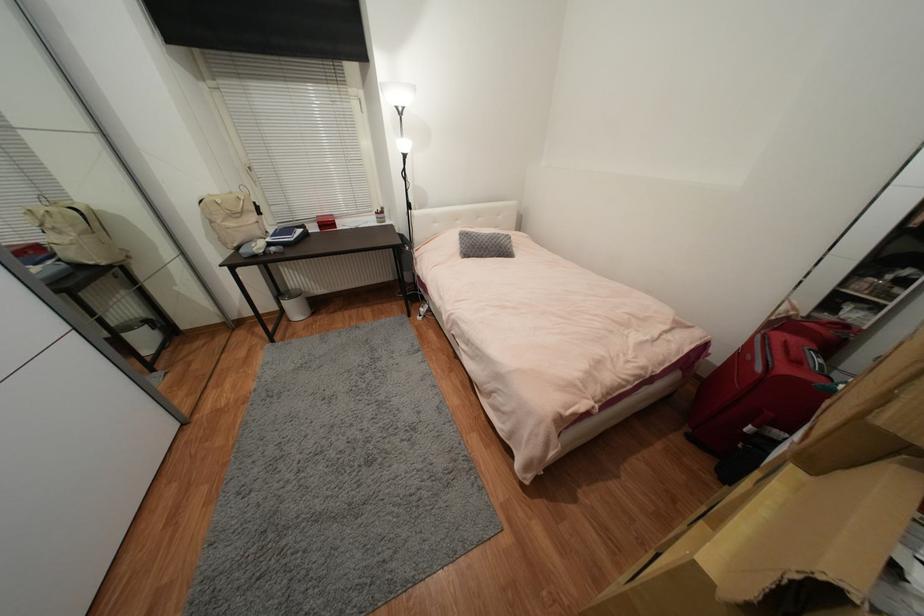
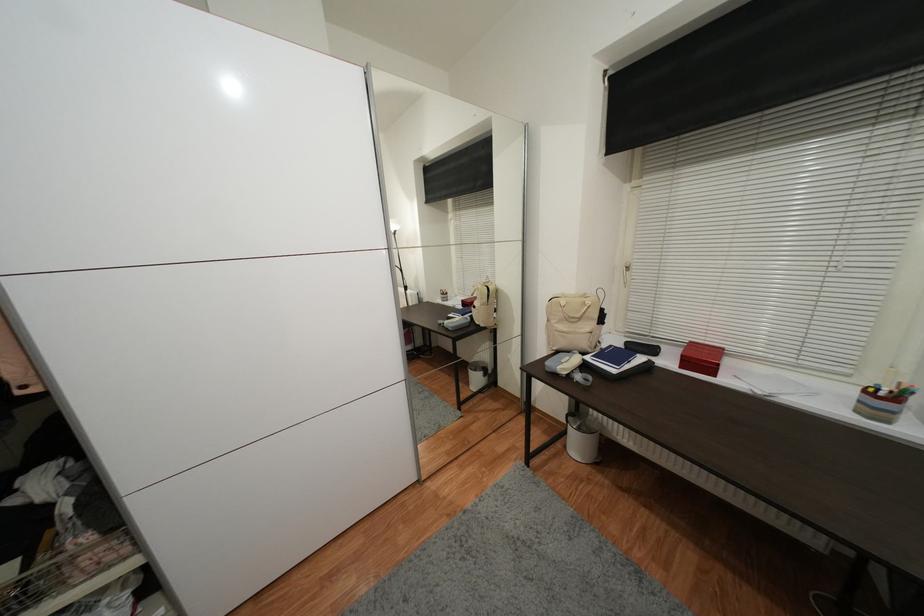
Locate, in the second image, the point that corresponds to point 294,322 in the first image.

(569, 448)